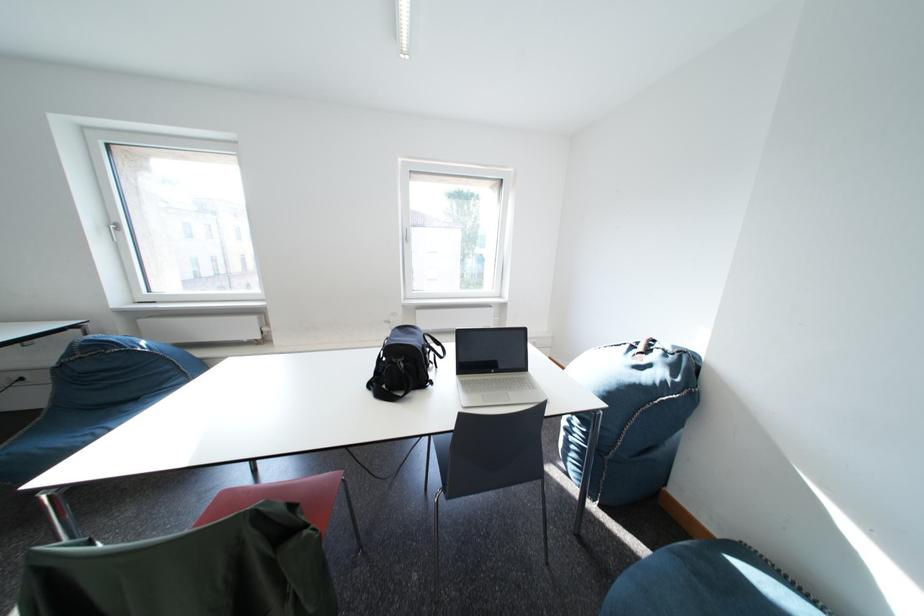
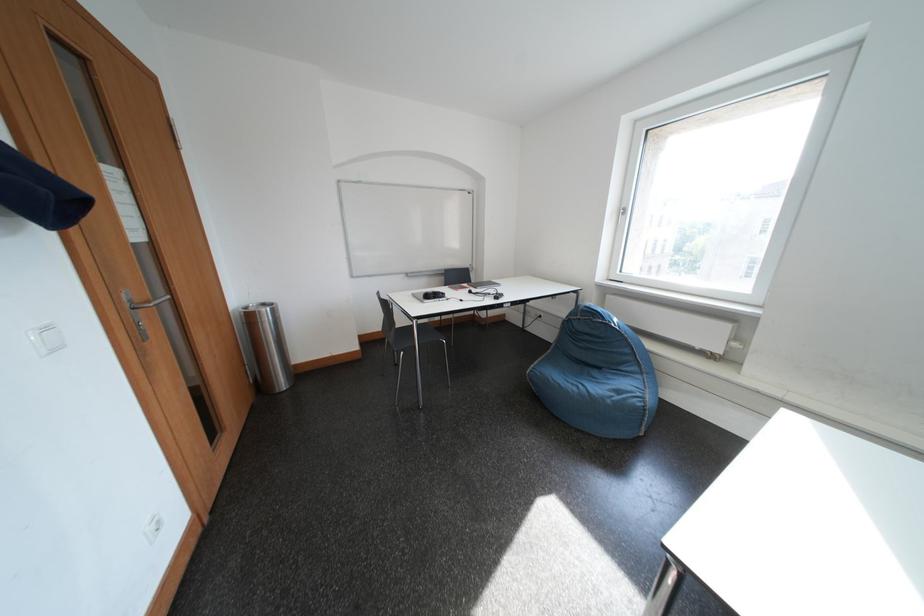
Question: The camera is either moving clockwise (left) or counter-clockwise (right) around the object. The first image is from the beginning of the video and the second image is from the end. Is the camera moving left or right when shooting the video?

Choices:
 (A) Left
 (B) Right

Answer: (B)